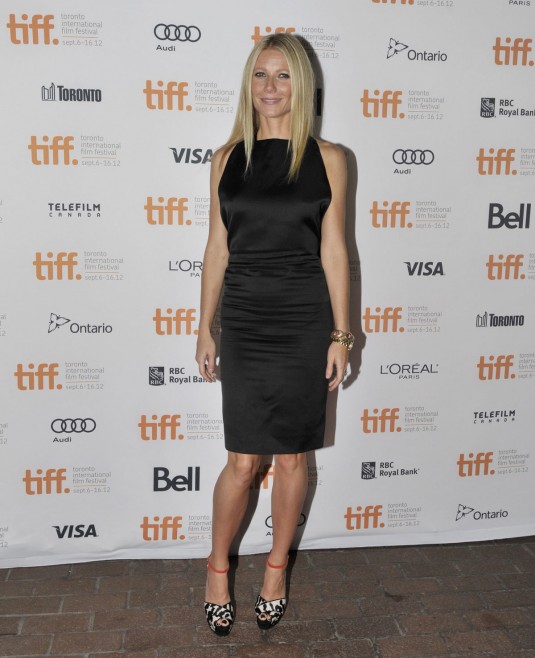
This screenshot has width=535, height=658. Identify the location of white wall with sponsor logos. (137, 249), (453, 239).